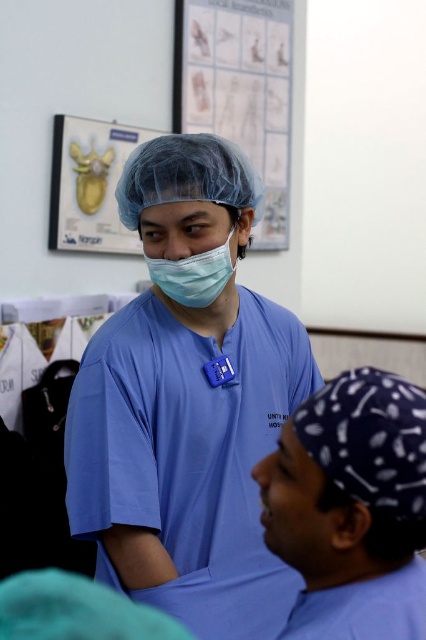
Question: Among these points, which one is nearest to the camera?

Choices:
 (A) (198, 301)
 (B) (149, 321)
 (C) (193, 10)

Answer: (A)

Question: In this image, where is matte blue scrubs at center located relative to white paper poster at upper center?

Choices:
 (A) below
 (B) above

Answer: (A)

Question: Which object is the farthest from the matte blue mask at center?

Choices:
 (A) matte blue scrubs at center
 (B) white paper poster at upper center

Answer: (B)

Question: Which object is closer to the camera taking this photo?

Choices:
 (A) white paper poster at upper center
 (B) matte blue mask at center
 (C) matte blue scrubs at center

Answer: (C)

Question: Is white paper poster at upper center below matte blue mask at center?

Choices:
 (A) yes
 (B) no

Answer: (B)

Question: From the image, what is the correct spatial relationship of white paper poster at upper center in relation to matte blue mask at center?

Choices:
 (A) left
 (B) right

Answer: (B)